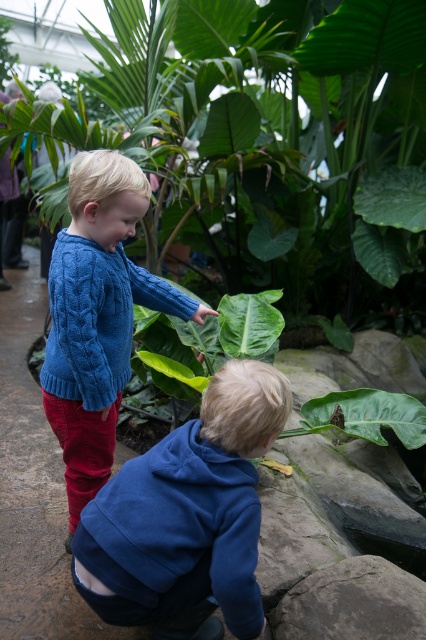
Question: Which of the following is the farthest from the observer?

Choices:
 (A) (161, 634)
 (B) (89, 340)

Answer: (B)

Question: Does blue fleece jacket at lower center appear under cable-knit sweater at center?

Choices:
 (A) yes
 (B) no

Answer: (A)

Question: Is cable-knit sweater at center further to camera compared to gray rough rock at lower center?

Choices:
 (A) no
 (B) yes

Answer: (A)

Question: Where is blue fleece jacket at lower center located in relation to cable-knit sweater at center in the image?

Choices:
 (A) above
 (B) below

Answer: (B)

Question: Estimate the real-world distances between objects in this image. Which object is closer to the green leafy plant at center?

Choices:
 (A) cable-knit sweater at center
 (B) gray rough rock at lower center

Answer: (A)

Question: Which object appears closest to the camera in this image?

Choices:
 (A) blue fleece jacket at lower center
 (B) green leafy plant at center
 (C) gray rough rock at lower center
 (D) cable-knit sweater at center

Answer: (A)